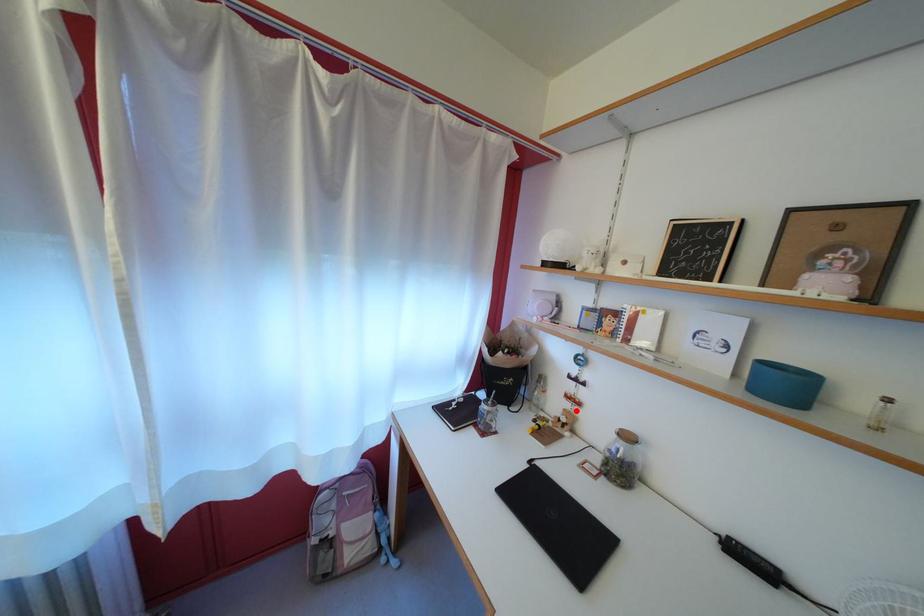
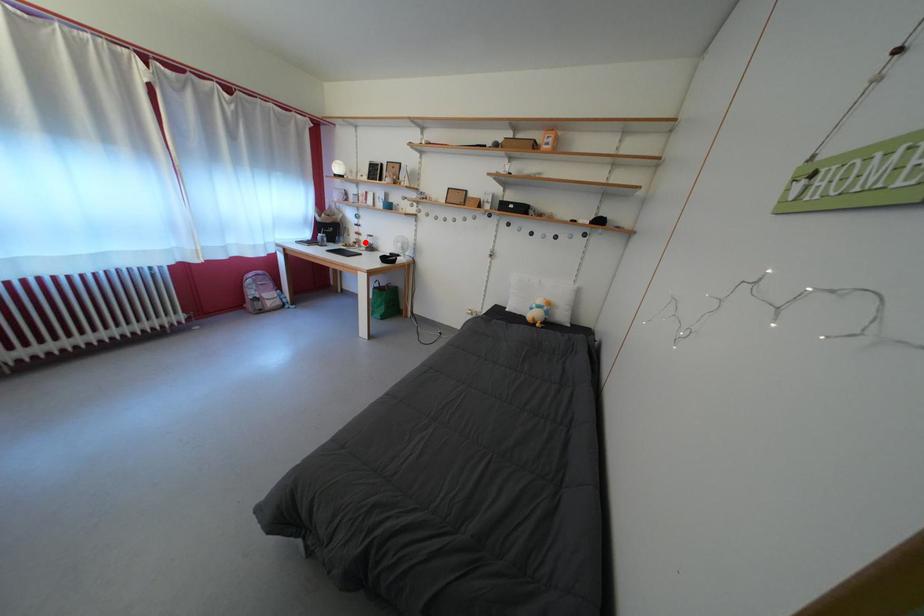
I am providing you with two images of the same scene from different viewpoints. A red point is marked on the first image and another point is marked on the second image. Is the marked point in image1 the same physical position as the marked point in image2?

Yes